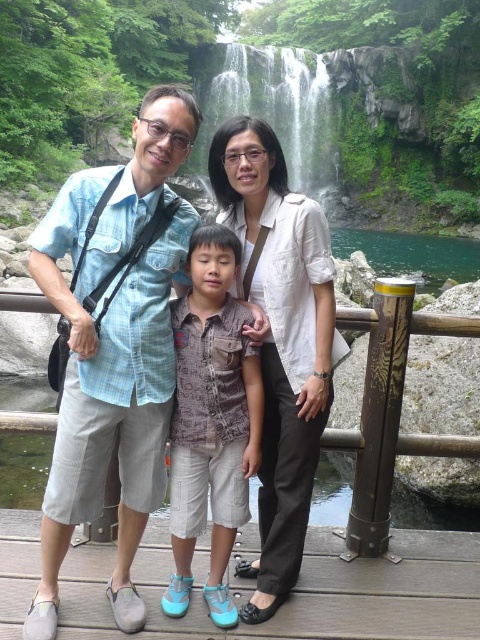
Question: Which object appears closest to the camera in this image?

Choices:
 (A) white cotton blouse at center
 (B) green mossy rock at upper center
 (C) brown printed shirt at center

Answer: (A)

Question: Estimate the real-world distances between objects in this image. Which object is farther from the light blue denim shirt at center?

Choices:
 (A) green mossy rock at upper center
 (B) white cotton blouse at center
 (C) brown printed shirt at center

Answer: (A)

Question: Which point appears closest to the camera in this image?

Choices:
 (A) (200, 403)
 (B) (141, 192)
 (C) (323, 132)

Answer: (A)

Question: Where is brown printed shirt at center located in relation to green mossy rock at upper center in the image?

Choices:
 (A) below
 (B) above

Answer: (A)

Question: Observing the image, what is the correct spatial positioning of brown printed shirt at center in reference to green mossy rock at upper center?

Choices:
 (A) right
 (B) left

Answer: (B)

Question: Is white cotton blouse at center to the right of brown printed shirt at center from the viewer's perspective?

Choices:
 (A) no
 (B) yes

Answer: (B)